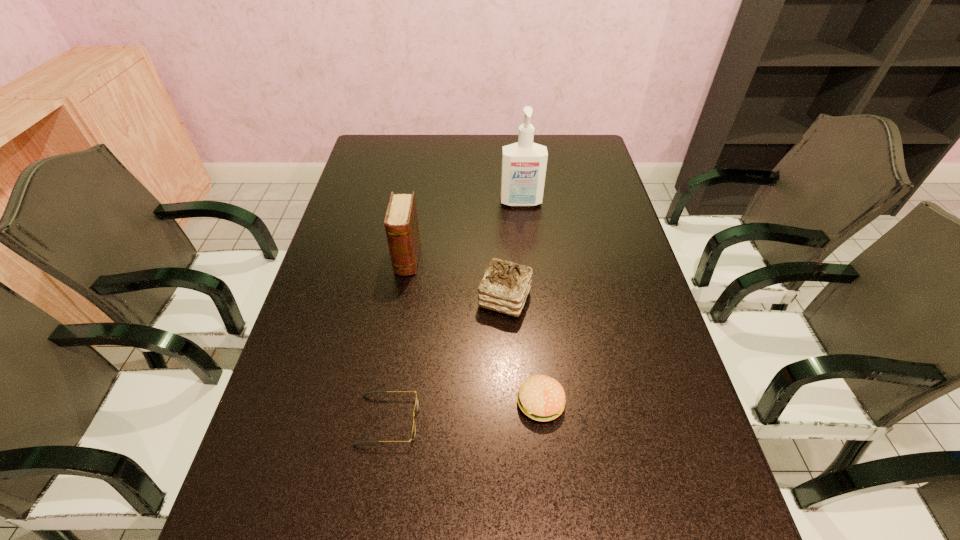
At what (x,y) coordinates should I click in order to perform the action: click on vacant position in the image that satisfies the following two spatial constraints: 1. on the spine side of the patty; 2. on the left side of the diary. Please return your answer as a coordinate pair (x, y). This screenshot has height=540, width=960. Looking at the image, I should click on (384, 403).

Locate an element on the screen. free location that satisfies the following two spatial constraints: 1. on the front side of the third farthest object; 2. on the right side of the second shortest object is located at coordinates (510, 403).